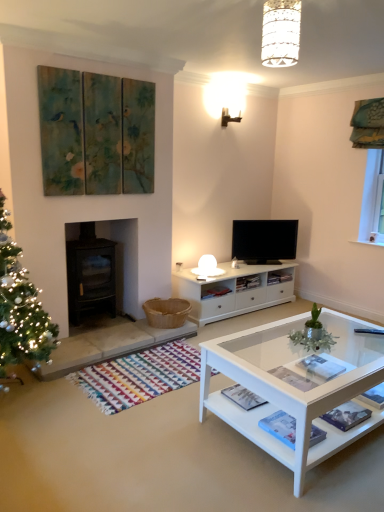
Question: Does white textured lampshade at upper center contain white glass coffee table at lower right?

Choices:
 (A) no
 (B) yes

Answer: (A)

Question: From a real-world perspective, is white textured lampshade at upper center below white glass coffee table at lower right?

Choices:
 (A) no
 (B) yes

Answer: (A)

Question: Is white textured lampshade at upper center thinner than white glass coffee table at lower right?

Choices:
 (A) yes
 (B) no

Answer: (A)

Question: Does white textured lampshade at upper center have a larger size compared to white glass coffee table at lower right?

Choices:
 (A) no
 (B) yes

Answer: (A)

Question: From the image's perspective, does white textured lampshade at upper center appear lower than white glass coffee table at lower right?

Choices:
 (A) yes
 (B) no

Answer: (B)

Question: Does white textured lampshade at upper center have a lesser height compared to white glass coffee table at lower right?

Choices:
 (A) no
 (B) yes

Answer: (B)

Question: Is white glass coffee table at lower right to the left of black glass fireplace at left from the viewer's perspective?

Choices:
 (A) yes
 (B) no

Answer: (B)

Question: From a real-world perspective, is white glass coffee table at lower right under black glass fireplace at left?

Choices:
 (A) no
 (B) yes

Answer: (B)

Question: Is white glass coffee table at lower right oriented towards black glass fireplace at left?

Choices:
 (A) no
 (B) yes

Answer: (B)

Question: Does white glass coffee table at lower right contain black glass fireplace at left?

Choices:
 (A) no
 (B) yes

Answer: (A)

Question: Does white glass coffee table at lower right lie behind black glass fireplace at left?

Choices:
 (A) no
 (B) yes

Answer: (A)

Question: From the image's perspective, is white glass coffee table at lower right located above black glass fireplace at left?

Choices:
 (A) no
 (B) yes

Answer: (A)

Question: From a real-world perspective, is flat screen tv at center beneath black glass fireplace at left?

Choices:
 (A) no
 (B) yes

Answer: (A)